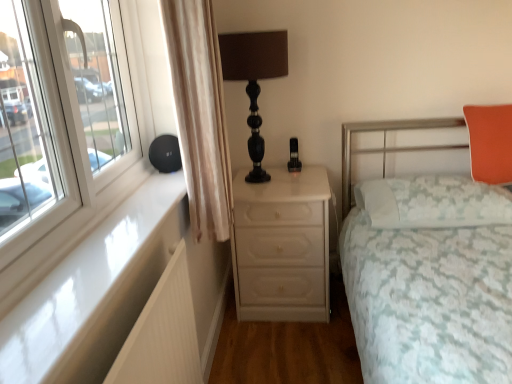
Where is `vacant point above white glossy window sill at left (from a real-world perspective)`? This screenshot has width=512, height=384. vacant point above white glossy window sill at left (from a real-world perspective) is located at coordinates (103, 241).